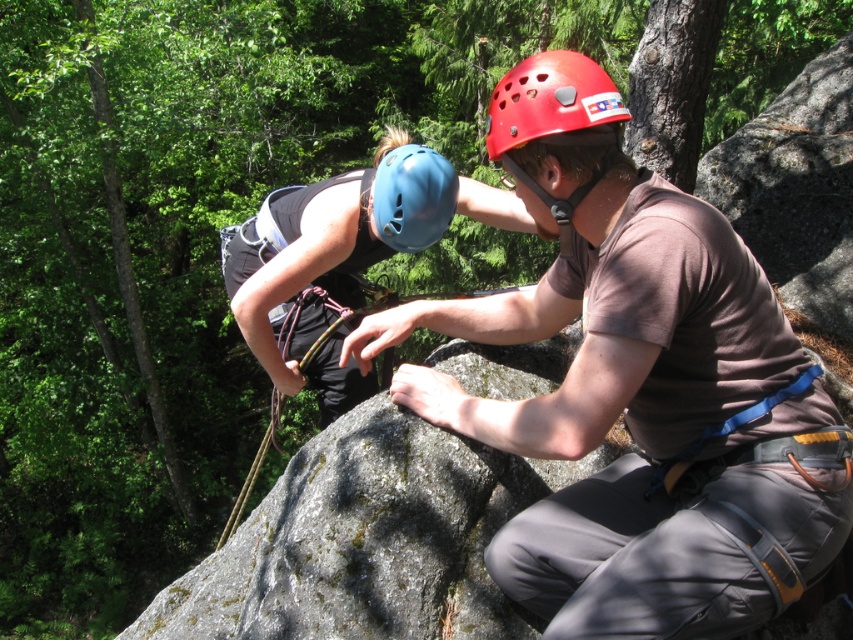
You are a safety inspector checking the climbing gear. You notice two helmets in the scene. Which helmet has a smaller width, the red matte helmet at center or the blue matte helmet at center?

→ The red matte helmet at center has a lesser width compared to the blue matte helmet at center, so the red matte helmet at center is smaller in width.

You are a photographer trying to capture both the matte brown shirt at center and the blue matte helmet at center in a single frame. Since you want to ensure both are clearly visible, which object should you focus on first to account for their sizes?

The matte brown shirt at center is larger in size than the blue matte helmet at center, so you should focus on the matte brown shirt at center first as it occupies more space in the frame.